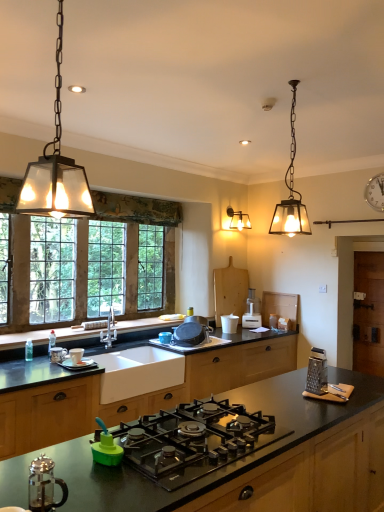
Question: Is matte glass pendant light at upper right, which appears as the 2th lamp when viewed from the left, at the back of wooden-framed glass window at left?

Choices:
 (A) yes
 (B) no

Answer: (B)

Question: Is wooden-framed glass window at left at the left side of matte glass pendant light at upper right, which ranks as the first lamp in back-to-front order?

Choices:
 (A) yes
 (B) no

Answer: (A)

Question: Does wooden-framed glass window at left have a smaller size compared to matte glass pendant light at upper right, which appears as the 2th lamp when viewed from the left?

Choices:
 (A) no
 (B) yes

Answer: (A)

Question: Is the depth of wooden-framed glass window at left less than that of matte glass pendant light at upper right, the 1th lamp from the right?

Choices:
 (A) yes
 (B) no

Answer: (B)

Question: Does wooden-framed glass window at left have a larger size compared to matte glass pendant light at upper right, the 1th lamp from the right?

Choices:
 (A) yes
 (B) no

Answer: (A)

Question: Is wooden-framed glass window at left outside of matte glass pendant light at upper right, which appears as the 2th lamp when viewed from the left?

Choices:
 (A) yes
 (B) no

Answer: (A)

Question: Is metallic grater at right, the first appliance positioned from the right, wider than white ceramic sink at center?

Choices:
 (A) no
 (B) yes

Answer: (A)

Question: Can you confirm if metallic grater at right, the sixth appliance from the left, is thinner than white ceramic sink at center?

Choices:
 (A) no
 (B) yes

Answer: (B)

Question: Is metallic grater at right, which is the 5th appliance in back-to-front order, taller than white ceramic sink at center?

Choices:
 (A) yes
 (B) no

Answer: (B)

Question: Is white ceramic sink at center located within metallic grater at right, the first appliance positioned from the right?

Choices:
 (A) yes
 (B) no

Answer: (B)

Question: From the image's perspective, is metallic grater at right, which is counted as the second appliance, starting from the front, located above white ceramic sink at center?

Choices:
 (A) no
 (B) yes

Answer: (B)

Question: From the image's perspective, does metallic grater at right, the sixth appliance from the left, appear lower than white ceramic sink at center?

Choices:
 (A) no
 (B) yes

Answer: (A)

Question: Is metallic grater at right, which is the 5th appliance in back-to-front order, taller than green plastic bottle at lower center, which is the fifth appliance in right-to-left order?

Choices:
 (A) no
 (B) yes

Answer: (B)